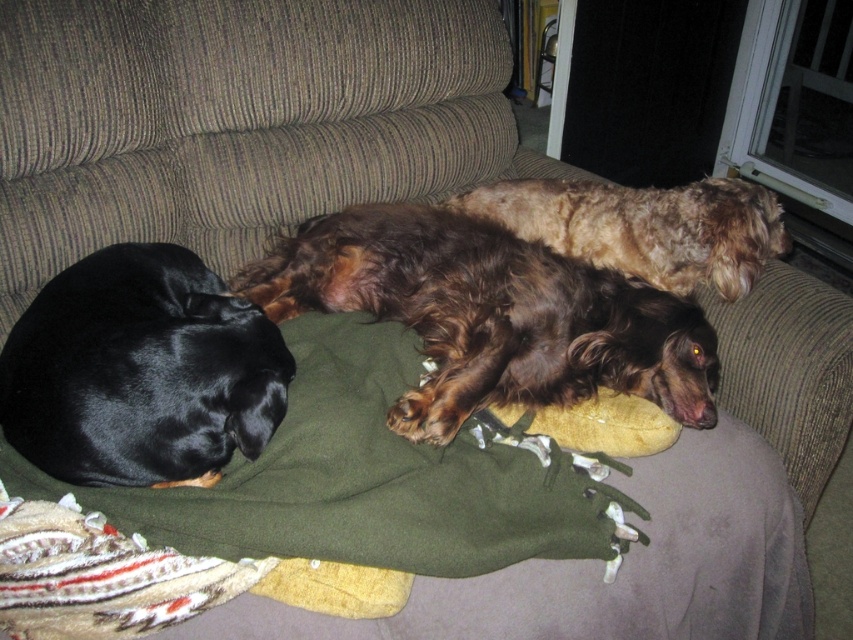
What is the 2D coordinate of the brown shaggy dog at center?

The brown shaggy dog at center is located at the 2D coordinate point of (491,314).

You are a photographer trying to capture a group photo of the black glossy dog at left and the fuzzy brown dog at center. Since you want both dogs to be clearly visible in the photo, which dog should you focus on to ensure it fills more of the frame?

The fuzzy brown dog at center occupies more space than the black glossy dog at left, so focusing on the fuzzy brown dog at center will ensure it fills more of the frame.